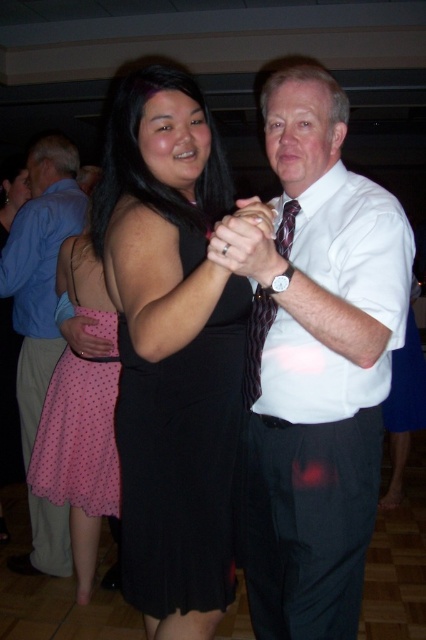
You are a photographer at the party and want to capture a closeup of the white smooth shirt at center and the pink polka dot fabric skirt at left. Which one should you zoom in on first if you want to focus on the wider object?

The white smooth shirt at center might be wider than pink polka dot fabric skirt at left, so you should zoom in on the white smooth shirt at center first to focus on the wider object.

You are a photographer trying to capture the couple in the center of the image. You notice the white smooth shirt at center and the pink polka dot fabric skirt at left. Which of these two items should you focus on to ensure the subject is properly sized in your photo?

The white smooth shirt at center has a larger size compared to the pink polka dot fabric skirt at left, so focusing on the white smooth shirt at center will ensure the subject is properly sized in your photo.